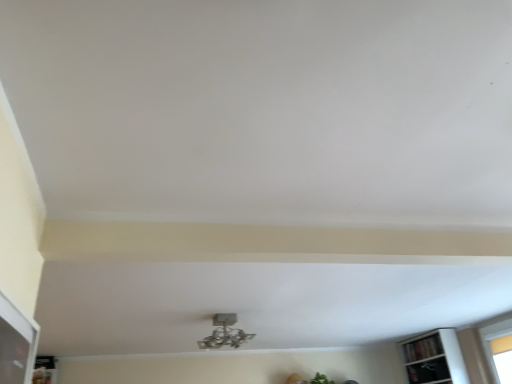
This screenshot has width=512, height=384. I want to click on wooden bookshelf at lower right, so click(x=422, y=348).

What do you see at coordinates (422, 348) in the screenshot?
I see `wooden bookshelf at lower right` at bounding box center [422, 348].

Locate an element on the screen. metallic silver chandelier at center is located at coordinates (225, 333).

Describe the element at coordinates (225, 333) in the screenshot. I see `metallic silver chandelier at center` at that location.

Where is `wooden bookshelf at lower right`? Image resolution: width=512 pixels, height=384 pixels. wooden bookshelf at lower right is located at coordinates (422, 348).

Considering the positions of objects metallic silver chandelier at center and wooden bookshelf at lower right in the image provided, who is more to the right, metallic silver chandelier at center or wooden bookshelf at lower right?

Positioned to the right is wooden bookshelf at lower right.

Considering their positions, is metallic silver chandelier at center located in front of or behind wooden bookshelf at lower right?

Clearly, metallic silver chandelier at center is in front of wooden bookshelf at lower right.

Which is less distant, (x=222, y=322) or (x=419, y=351)?

The point (x=222, y=322) is closer to the camera.

From the image's perspective, is metallic silver chandelier at center below wooden bookshelf at lower right?

No, from the image's perspective, metallic silver chandelier at center is not beneath wooden bookshelf at lower right.

From a real-world perspective, between metallic silver chandelier at center and wooden bookshelf at lower right, who is vertically higher?

In real-world perspective, metallic silver chandelier at center is above.

In terms of width, does metallic silver chandelier at center look wider or thinner when compared to wooden bookshelf at lower right?

In the image, metallic silver chandelier at center appears to be wider than wooden bookshelf at lower right.

Does metallic silver chandelier at center have a lesser height compared to wooden bookshelf at lower right?

No.

Between metallic silver chandelier at center and wooden bookshelf at lower right, which one has larger size?

Bigger between the two is metallic silver chandelier at center.

Is metallic silver chandelier at center positioned beyond the bounds of wooden bookshelf at lower right?

Indeed, metallic silver chandelier at center is completely outside wooden bookshelf at lower right.

Are metallic silver chandelier at center and wooden bookshelf at lower right making contact?

No, metallic silver chandelier at center is not with wooden bookshelf at lower right.

Is wooden bookshelf at lower right at the back of metallic silver chandelier at center?

Yes, metallic silver chandelier at center is positioned with its back facing wooden bookshelf at lower right.

How far apart are metallic silver chandelier at center and wooden bookshelf at lower right?

2.03 meters.

I want to click on shelf that is below the metallic silver chandelier at center (from the image's perspective), so click(422, 348).

Which object is positioned more to the left, wooden bookshelf at lower right or metallic silver chandelier at center?

Positioned to the left is metallic silver chandelier at center.

Based on the photo, does wooden bookshelf at lower right lie behind metallic silver chandelier at center?

Yes, it is behind metallic silver chandelier at center.

Between point (438, 344) and point (231, 331), which one is positioned behind?

Point (438, 344)

From the image's perspective, is wooden bookshelf at lower right beneath metallic silver chandelier at center?

Indeed, from the image's perspective, wooden bookshelf at lower right is shown beneath metallic silver chandelier at center.

From a real-world perspective, is wooden bookshelf at lower right under metallic silver chandelier at center?

Result: Yes, from a real-world perspective, wooden bookshelf at lower right is below metallic silver chandelier at center.

In terms of width, does wooden bookshelf at lower right look wider or thinner when compared to metallic silver chandelier at center?

In the image, wooden bookshelf at lower right appears to be more narrow than metallic silver chandelier at center.

Considering the sizes of objects wooden bookshelf at lower right and metallic silver chandelier at center in the image provided, who is taller, wooden bookshelf at lower right or metallic silver chandelier at center?

Standing taller between the two is metallic silver chandelier at center.

Who is bigger, wooden bookshelf at lower right or metallic silver chandelier at center?

metallic silver chandelier at center is bigger.

Would you say wooden bookshelf at lower right contains metallic silver chandelier at center?

No.

Are wooden bookshelf at lower right and metallic silver chandelier at center beside each other?

No, wooden bookshelf at lower right is not in contact with metallic silver chandelier at center.

Is metallic silver chandelier at center at the back of wooden bookshelf at lower right?

No, metallic silver chandelier at center is not at the back of wooden bookshelf at lower right.

What's the angular difference between wooden bookshelf at lower right and metallic silver chandelier at center's facing directions?

The angular difference between wooden bookshelf at lower right and metallic silver chandelier at center is 3.91 degrees.

How much distance is there between wooden bookshelf at lower right and metallic silver chandelier at center?

wooden bookshelf at lower right is 6.65 feet away from metallic silver chandelier at center.

The image size is (512, 384). Identify the location of lamp in front of the wooden bookshelf at lower right. (225, 333).

This screenshot has height=384, width=512. In the image, there is a metallic silver chandelier at center. What are the coordinates of `shelf below it (from a real-world perspective)` in the screenshot? It's located at (422, 348).

Find the location of a particular element. The image size is (512, 384). shelf located on the right of metallic silver chandelier at center is located at coordinates (422, 348).